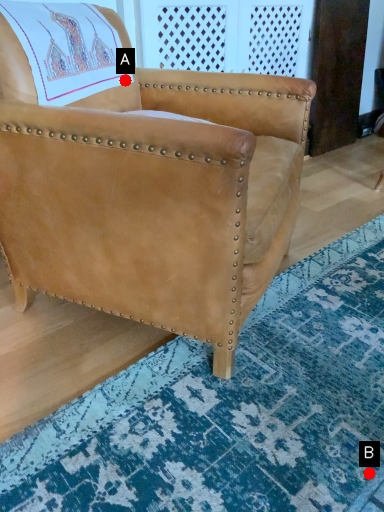
Question: Two points are circled on the image, labeled by A and B beside each circle. Among these points, which one is farthest from the camera?

Choices:
 (A) A is further
 (B) B is further

Answer: (A)